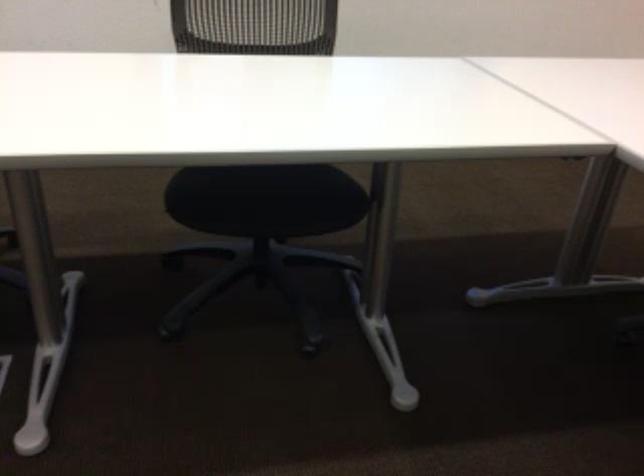
I want to click on chair sitting surface, so (x=266, y=199).